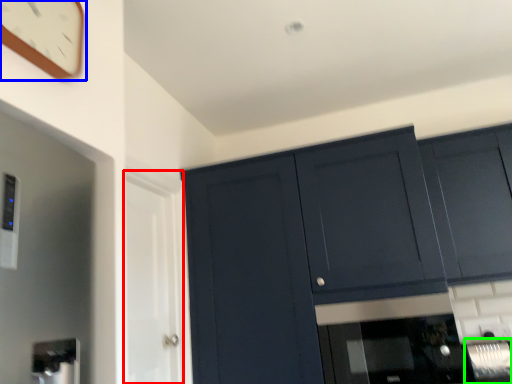
Question: Which is nearer to the glass door (highlighted by a red box)? clock (highlighted by a blue box) or appliance (highlighted by a green box).

Choices:
 (A) clock
 (B) appliance

Answer: (A)